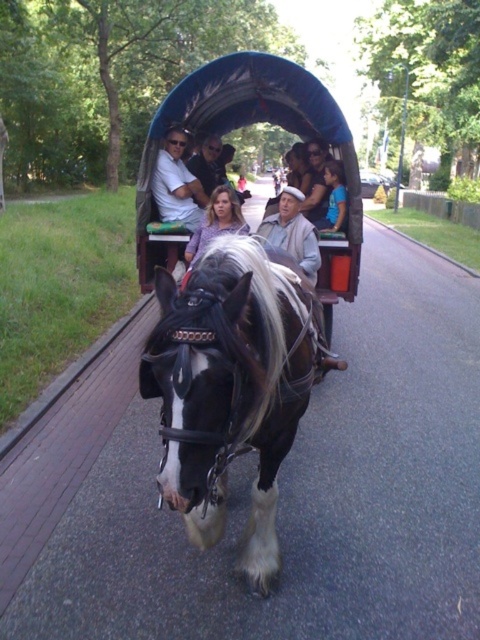
Between white cotton shirt at upper center and smooth purple blouse at center, which one is positioned lower?

smooth purple blouse at center

The height and width of the screenshot is (640, 480). What do you see at coordinates (177, 182) in the screenshot?
I see `white cotton shirt at upper center` at bounding box center [177, 182].

This screenshot has height=640, width=480. Describe the element at coordinates (177, 182) in the screenshot. I see `white cotton shirt at upper center` at that location.

Where is `white cotton shirt at upper center`? This screenshot has width=480, height=640. white cotton shirt at upper center is located at coordinates (177, 182).

Where is `shiny blue fabric cart at center`? The height and width of the screenshot is (640, 480). shiny blue fabric cart at center is located at coordinates (250, 124).

Does shiny blue fabric cart at center appear over white cotton shirt at upper center?

Yes.

This screenshot has height=640, width=480. What do you see at coordinates (250, 124) in the screenshot?
I see `shiny blue fabric cart at center` at bounding box center [250, 124].

Locate an element on the screen. Image resolution: width=480 pixels, height=640 pixels. shiny blue fabric cart at center is located at coordinates click(x=250, y=124).

Is shiny blue fabric cart at center positioned at the back of smooth purple blouse at center?

Yes, it is behind smooth purple blouse at center.

Where is `shiny blue fabric cart at center`? The width and height of the screenshot is (480, 640). shiny blue fabric cart at center is located at coordinates (250, 124).

Identify the location of shiny blue fabric cart at center. The height and width of the screenshot is (640, 480). (250, 124).